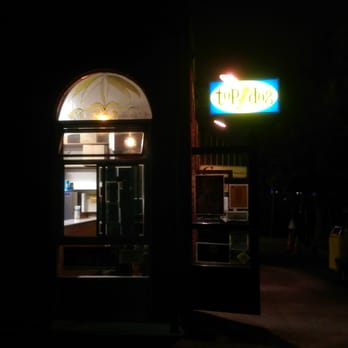
The width and height of the screenshot is (348, 348). Find the location of `door maybe`. door maybe is located at coordinates (225, 291).